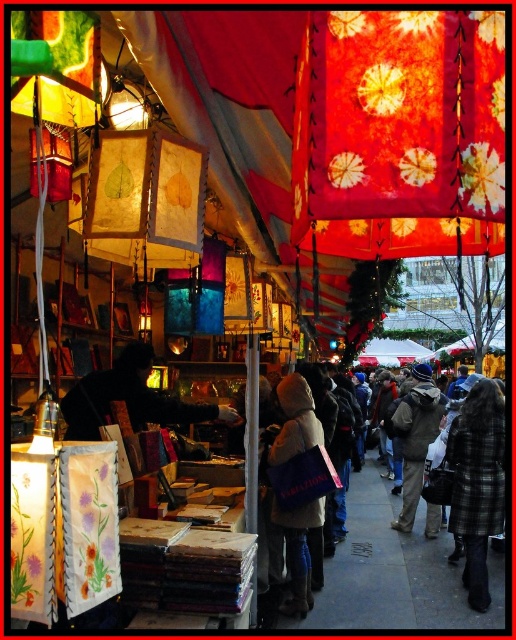
Between point (305, 192) and point (160, 244), which one is positioned behind?

Point (160, 244)

Can you confirm if batik fabric lantern at upper center is shorter than handmade paper lantern at center?

No.

This screenshot has height=640, width=516. I want to click on batik fabric lantern at upper center, so click(399, 132).

Is black fabric at center positioned behind fluffy beige coat at center?

No, it is in front of fluffy beige coat at center.

What are the coordinates of `black fabric at center` in the screenshot? It's located at (131, 397).

Measure the distance between batik fabric lantern at upper center and camera.

A distance of 1.22 meters exists between batik fabric lantern at upper center and camera.

Is batik fabric lantern at upper center to the left of black fabric at center from the viewer's perspective?

In fact, batik fabric lantern at upper center is to the right of black fabric at center.

Where is `batik fabric lantern at upper center`? batik fabric lantern at upper center is located at coordinates [x=399, y=132].

Identify the location of batik fabric lantern at upper center. (399, 132).